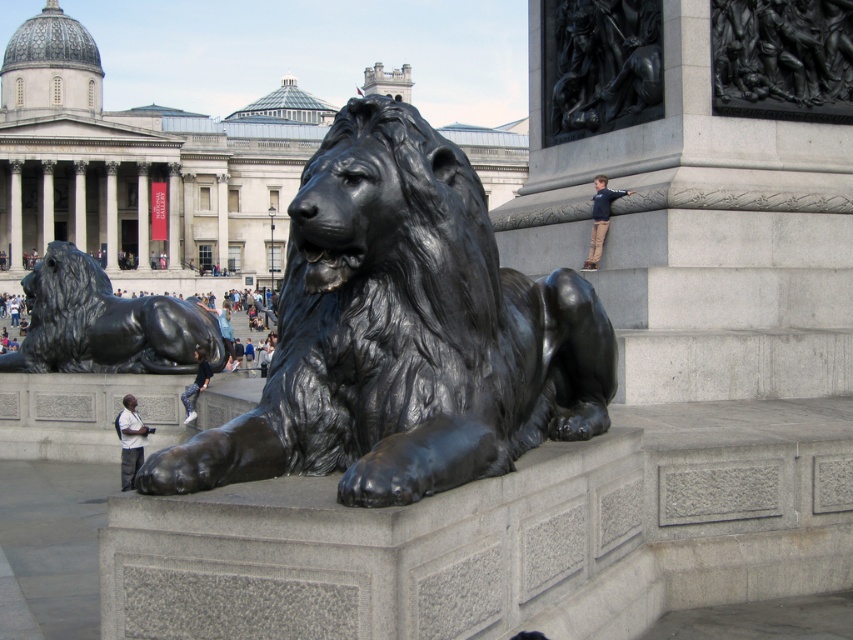
Question: Considering the real-world distances, which object is farthest from the light gray shirt at lower left?

Choices:
 (A) polished bronze figures at upper right
 (B) polished bronze lion at lower left
 (C) denim pants at lower left
 (D) dark blue jacket at upper right

Answer: (A)

Question: Which point appears farthest from the camera in this image?

Choices:
 (A) (494, 317)
 (B) (555, 93)
 (C) (605, 228)
 (D) (136, 458)

Answer: (B)

Question: Does polished bronze figures at upper right have a lesser width compared to dark blue jacket at upper right?

Choices:
 (A) yes
 (B) no

Answer: (B)

Question: Which object is farther from the camera taking this photo?

Choices:
 (A) dark blue jacket at upper right
 (B) polished black lion at center
 (C) polished bronze lion at lower left
 (D) black polished stone relief at upper center

Answer: (C)

Question: Does polished black lion at center have a lesser width compared to black polished stone relief at upper center?

Choices:
 (A) no
 (B) yes

Answer: (A)

Question: Is polished black lion at center smaller than polished bronze figures at upper right?

Choices:
 (A) no
 (B) yes

Answer: (A)